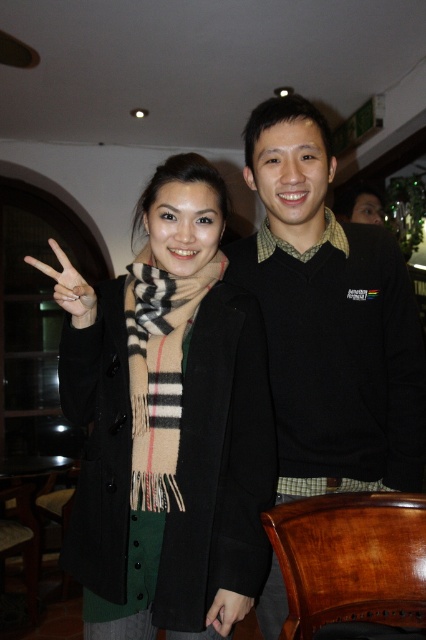
Question: Does plaid wool scarf at center have a greater width compared to matte black hand at lower center?

Choices:
 (A) yes
 (B) no

Answer: (A)

Question: Which point appears farthest from the camera in this image?

Choices:
 (A) (49, 268)
 (B) (210, 618)
 (C) (180, 369)
 (D) (423, 360)

Answer: (D)

Question: Which object appears farthest from the camera in this image?

Choices:
 (A) white wool scarf at center
 (B) plaid wool scarf at center

Answer: (B)

Question: Does black wool scarf at center appear on the left side of black sweater at right?

Choices:
 (A) no
 (B) yes

Answer: (B)

Question: Which is nearer to the black sweater at right?

Choices:
 (A) white wool scarf at center
 (B) matte black hand at lower center

Answer: (A)

Question: Is black sweater at right positioned at the back of matte black hand at lower center?

Choices:
 (A) no
 (B) yes

Answer: (B)